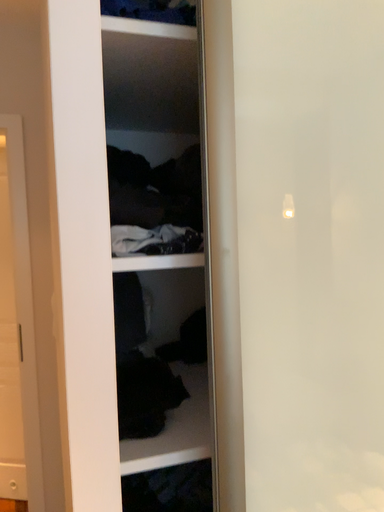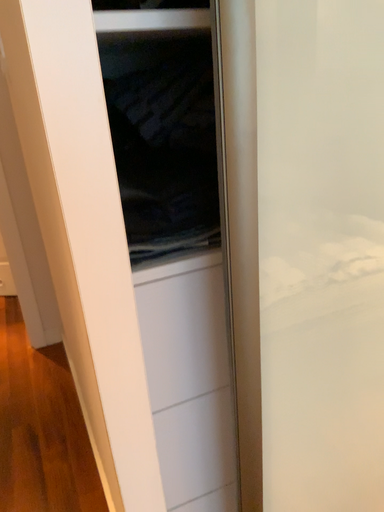
Question: Which way did the camera rotate in the video?

Choices:
 (A) rotated upward
 (B) rotated downward

Answer: (B)